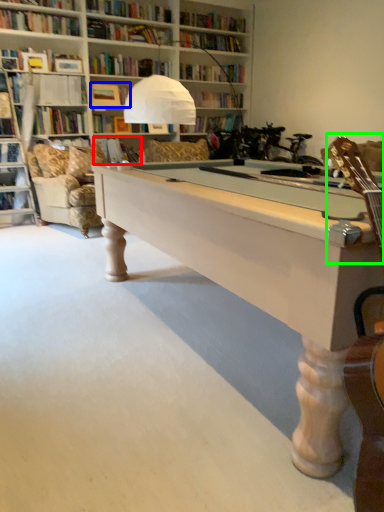
Question: Estimate the real-world distances between objects in this image. Which object is farther from book (highlighted by a red box), book (highlighted by a blue box) or guitar (highlighted by a green box)?

Choices:
 (A) book
 (B) guitar

Answer: (B)